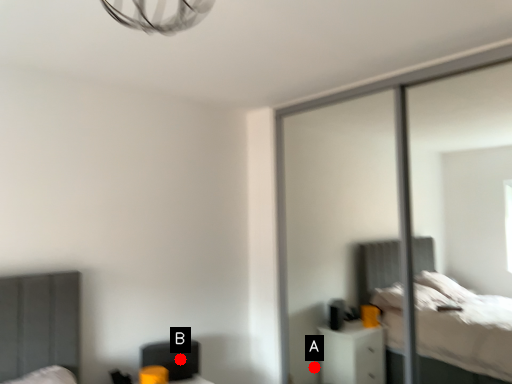
Question: Two points are circled on the image, labeled by A and B beside each circle. Among these points, which one is nearest to the camera?

Choices:
 (A) A is closer
 (B) B is closer

Answer: (B)